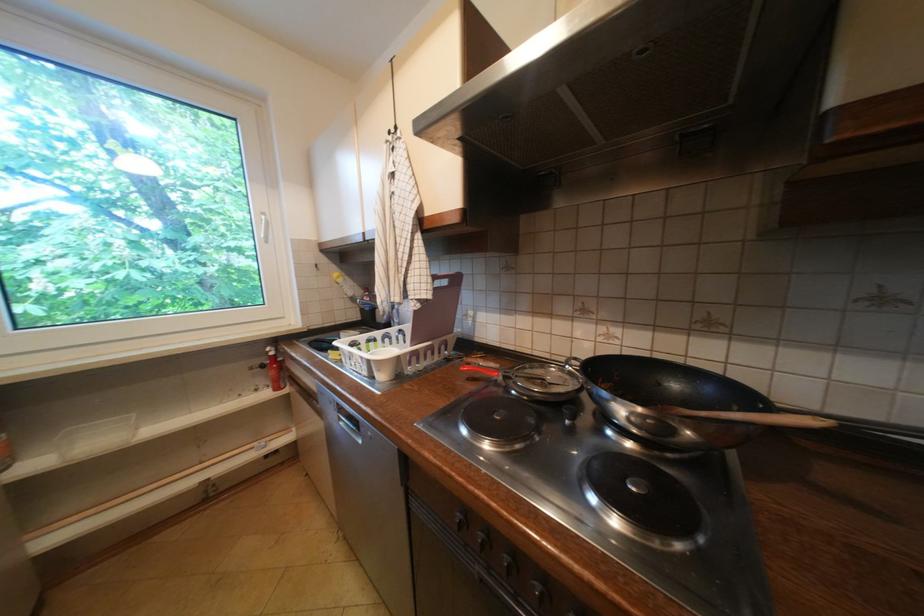
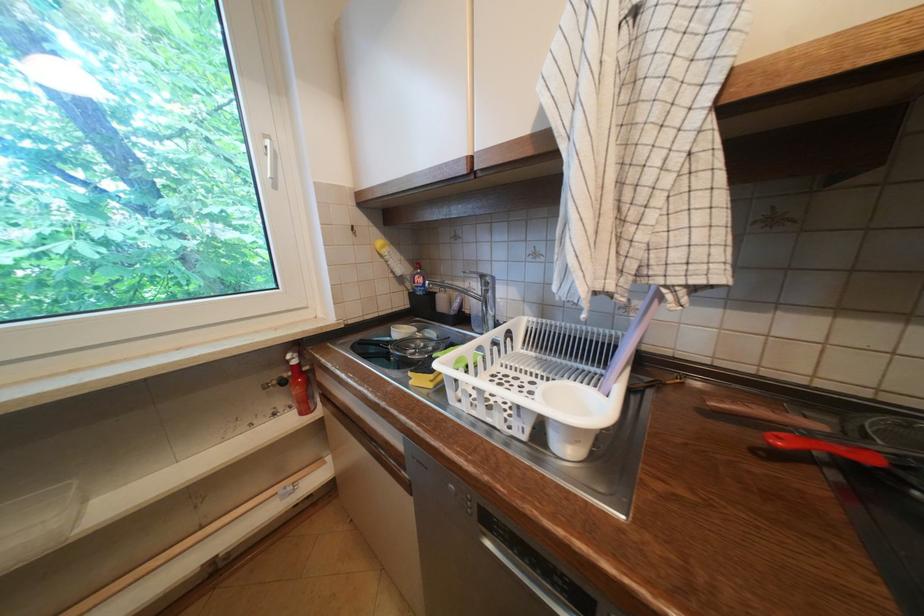
Find the pixel in the second image that matches point (472, 369) in the first image.

(788, 440)